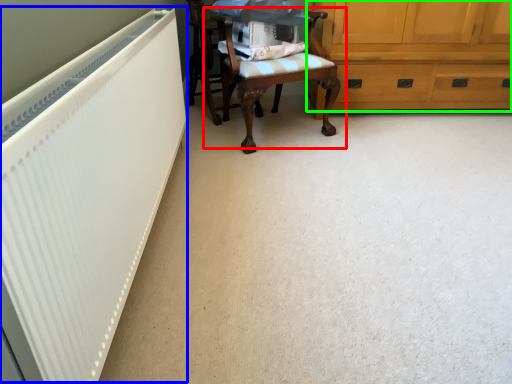
Question: Which object is the closest to the chair (highlighted by a red box)? Choose among these: radiator (highlighted by a blue box) or cabinetry (highlighted by a green box).

Choices:
 (A) radiator
 (B) cabinetry

Answer: (B)